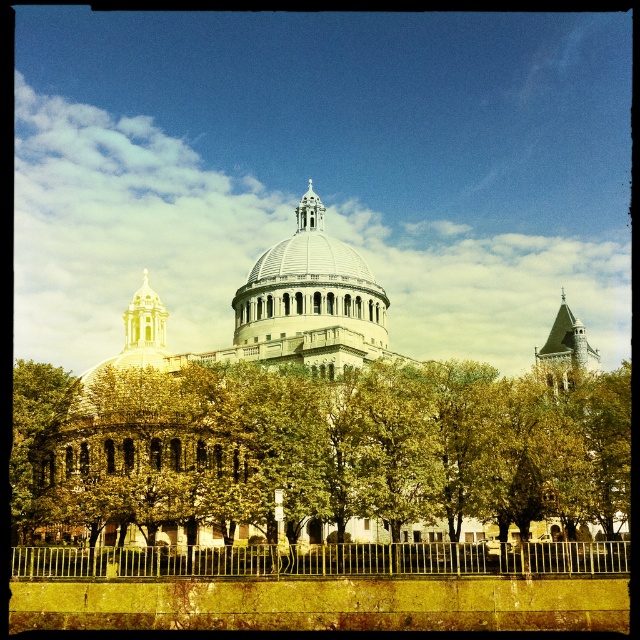
Measure the distance between green leafy tree at center and gold metallic fence at lower center.

green leafy tree at center and gold metallic fence at lower center are 6.67 meters apart.

Who is taller, green leafy tree at center or gold metallic fence at lower center?

Standing taller between the two is green leafy tree at center.

Describe the element at coordinates (332, 452) in the screenshot. Image resolution: width=640 pixels, height=640 pixels. I see `green leafy tree at center` at that location.

Identify the location of green leafy tree at center. The height and width of the screenshot is (640, 640). (332, 452).

Is green leafy tree at center taller than white marble dome at center?

In fact, green leafy tree at center may be shorter than white marble dome at center.

Who is more distant from viewer, (212, 508) or (316, 324)?

The point (316, 324) is behind.

Identify the location of green leafy tree at center. (332, 452).

Between gold metallic fence at lower center and white marble dome at center, which one has more height?

Standing taller between the two is white marble dome at center.

Does point (451, 556) lie in front of point (237, 312)?

Yes, point (451, 556) is closer to viewer.

Who is more distant from viewer, [300,557] or [248,291]?

Point [248,291]

Find the location of a particular element. The width and height of the screenshot is (640, 640). gold metallic fence at lower center is located at coordinates (323, 560).